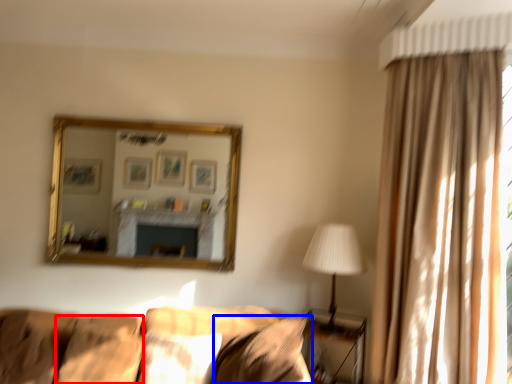
Question: Which object appears farthest to the camera in this image, pillow (highlighted by a red box) or pillow (highlighted by a blue box)?

Choices:
 (A) pillow
 (B) pillow

Answer: (A)